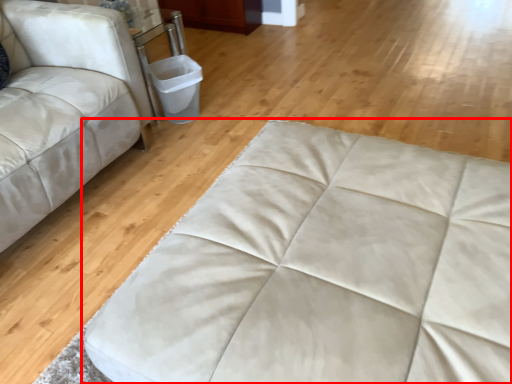
Question: Observing the image, what is the correct spatial positioning of furniture (annotated by the red box) in reference to studio couch?

Choices:
 (A) right
 (B) left

Answer: (A)